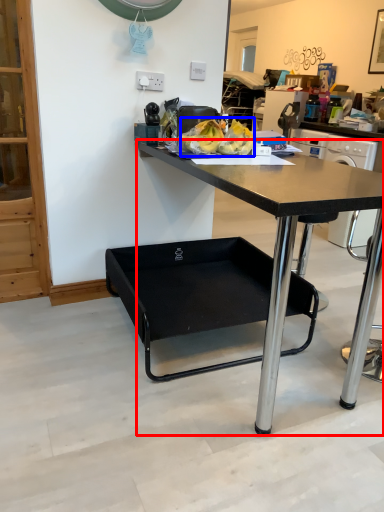
Question: Which point is closer to the camera, desk (highlighted by a red box) or food (highlighted by a blue box)?

Choices:
 (A) desk
 (B) food

Answer: (A)